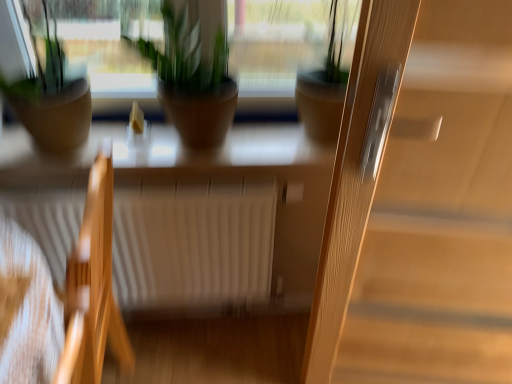
Question: Considering the relative sizes of matte brown pot at center, acting as the 2th houseplant starting from the left, and green matte plant pot at center, the first houseplant from the right, in the image provided, is matte brown pot at center, acting as the 2th houseplant starting from the left, wider than green matte plant pot at center, the first houseplant from the right,?

Choices:
 (A) no
 (B) yes

Answer: (B)

Question: Would you say matte brown pot at center, which is counted as the second houseplant, starting from the right, is outside green matte plant pot at center, which ranks as the 3th houseplant in left-to-right order?

Choices:
 (A) yes
 (B) no

Answer: (A)

Question: Is the position of matte brown pot at center, which is counted as the second houseplant, starting from the right, more distant than that of green matte plant pot at center, the first houseplant from the right?

Choices:
 (A) yes
 (B) no

Answer: (B)

Question: Is matte brown pot at center, which is counted as the second houseplant, starting from the right, in front of green matte plant pot at center, the first houseplant from the right?

Choices:
 (A) no
 (B) yes

Answer: (B)

Question: Considering the relative sizes of matte brown pot at center, acting as the 2th houseplant starting from the left, and green matte plant pot at center, which ranks as the 3th houseplant in left-to-right order, in the image provided, is matte brown pot at center, acting as the 2th houseplant starting from the left, taller than green matte plant pot at center, which ranks as the 3th houseplant in left-to-right order,?

Choices:
 (A) no
 (B) yes

Answer: (A)

Question: From the image's perspective, is matte brown pot at center, which is counted as the second houseplant, starting from the right, below green matte plant pot at center, the first houseplant from the right?

Choices:
 (A) yes
 (B) no

Answer: (A)

Question: Is wooden chair at left thinner than white matte radiator at center?

Choices:
 (A) yes
 (B) no

Answer: (B)

Question: From the image's perspective, is wooden chair at left above white matte radiator at center?

Choices:
 (A) yes
 (B) no

Answer: (B)

Question: Is wooden chair at left oriented away from white matte radiator at center?

Choices:
 (A) yes
 (B) no

Answer: (B)

Question: Is wooden chair at left next to white matte radiator at center?

Choices:
 (A) yes
 (B) no

Answer: (B)

Question: Can white matte radiator at center be found inside wooden chair at left?

Choices:
 (A) yes
 (B) no

Answer: (B)

Question: Is wooden chair at left far from white matte radiator at center?

Choices:
 (A) yes
 (B) no

Answer: (B)

Question: Would you consider green matte plant pot at center, which ranks as the 3th houseplant in left-to-right order, to be distant from wooden chair at left?

Choices:
 (A) no
 (B) yes

Answer: (A)